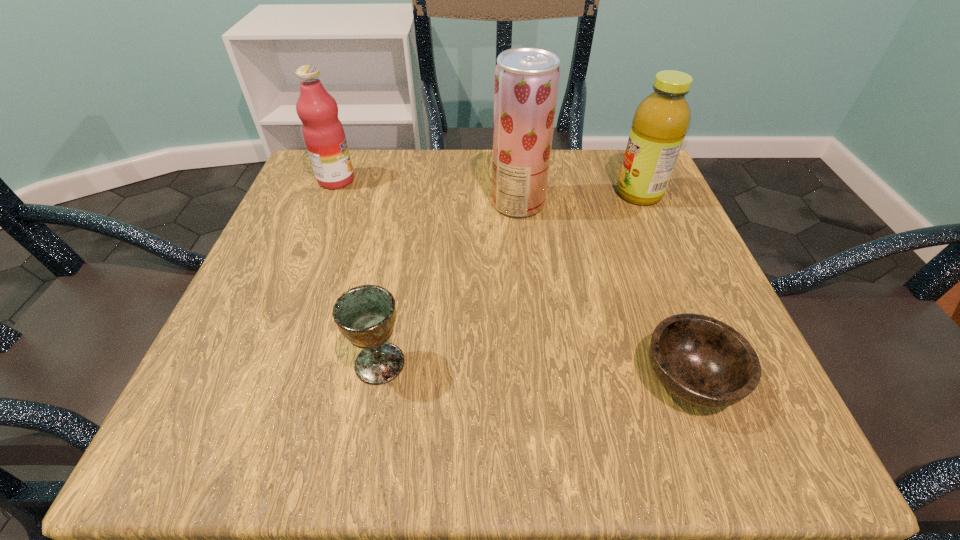
Identify which fruit juice is the nearest to the rightmost fruit juice. Please provide its 2D coordinates. Your answer should be formatted as a tuple, i.e. [(x, y)], where the tuple contains the x and y coordinates of a point satisfying the conditions above.

[(526, 85)]

Identify which fruit juice is the nearest to the leftmost object. Please provide its 2D coordinates. Your answer should be formatted as a tuple, i.e. [(x, y)], where the tuple contains the x and y coordinates of a point satisfying the conditions above.

[(526, 85)]

Where is `vacant position in the image that satisfies the following two spatial constraints: 1. on the label of the leftmost fruit juice; 2. on the right side of the bowl`? Image resolution: width=960 pixels, height=540 pixels. vacant position in the image that satisfies the following two spatial constraints: 1. on the label of the leftmost fruit juice; 2. on the right side of the bowl is located at coordinates (257, 379).

At what (x,y) coordinates should I click in order to perform the action: click on free location that satisfies the following two spatial constraints: 1. on the label of the leftmost fruit juice; 2. on the back side of the third object from left to right. Please return your answer as a coordinate pair (x, y). Image resolution: width=960 pixels, height=540 pixels. Looking at the image, I should click on (327, 203).

Where is `free space that satisfies the following two spatial constraints: 1. on the label of the fourth tallest object; 2. on the right side of the leftmost fruit juice`? The height and width of the screenshot is (540, 960). free space that satisfies the following two spatial constraints: 1. on the label of the fourth tallest object; 2. on the right side of the leftmost fruit juice is located at coordinates (263, 363).

Find the location of a particular element. The image size is (960, 540). free spot that satisfies the following two spatial constraints: 1. on the label of the chalice; 2. on the left side of the leftmost fruit juice is located at coordinates (263, 363).

Identify the location of free location that satisfies the following two spatial constraints: 1. on the label of the shortest object; 2. on the left side of the leftmost object. This screenshot has width=960, height=540. (257, 379).